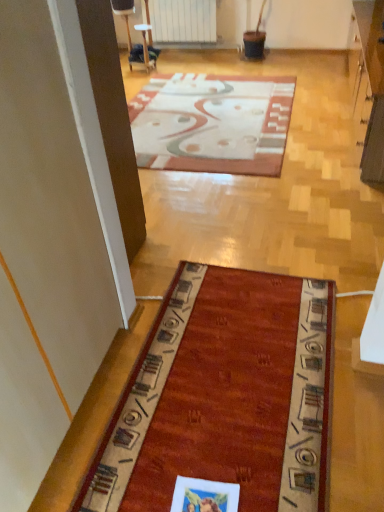
This screenshot has width=384, height=512. Find the location of `free point above patterned carpet at center (from a real-world perspective)`. free point above patterned carpet at center (from a real-world perspective) is located at coordinates (212, 112).